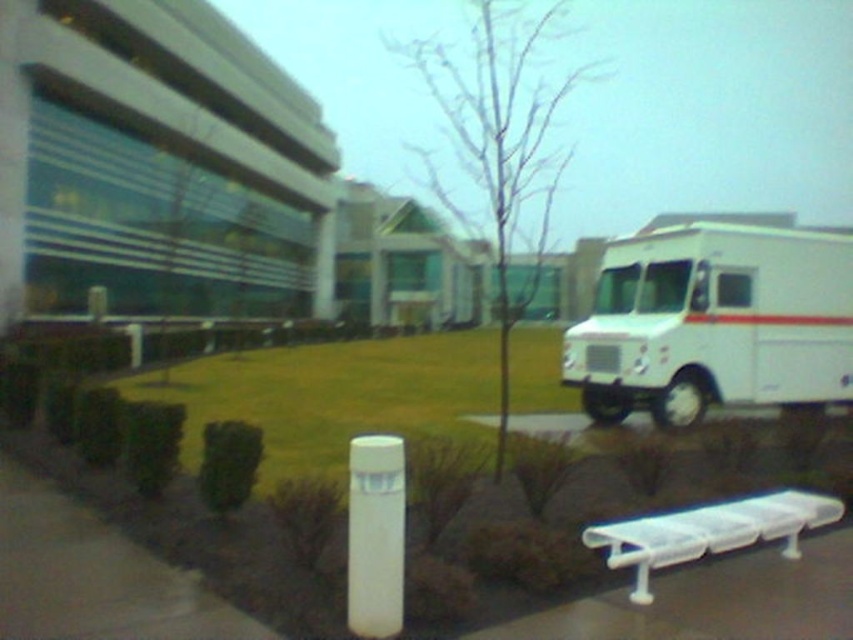
Question: Which point appears farthest from the camera in this image?

Choices:
 (A) (616, 314)
 (B) (624, 563)

Answer: (A)

Question: In this image, where is white matte truck at right located relative to white plastic bench at lower right?

Choices:
 (A) right
 (B) left

Answer: (A)

Question: Which point is farther to the camera?

Choices:
 (A) (791, 508)
 (B) (787, 300)

Answer: (B)

Question: From the image, what is the correct spatial relationship of white matte truck at right in relation to white plastic bench at lower right?

Choices:
 (A) right
 (B) left

Answer: (A)

Question: Does white matte truck at right lie in front of white plastic bench at lower right?

Choices:
 (A) yes
 (B) no

Answer: (B)